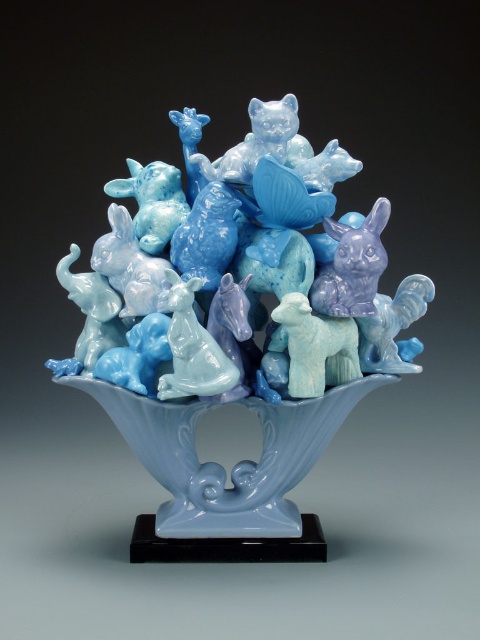
Describe the element at coordinates (236, 324) in the screenshot. I see `matte porcelain animals at center` at that location.

Is point (247, 376) positioned in front of point (261, 506)?

Yes, point (247, 376) is closer to viewer.

I want to click on matte porcelain animals at center, so pyautogui.click(x=236, y=324).